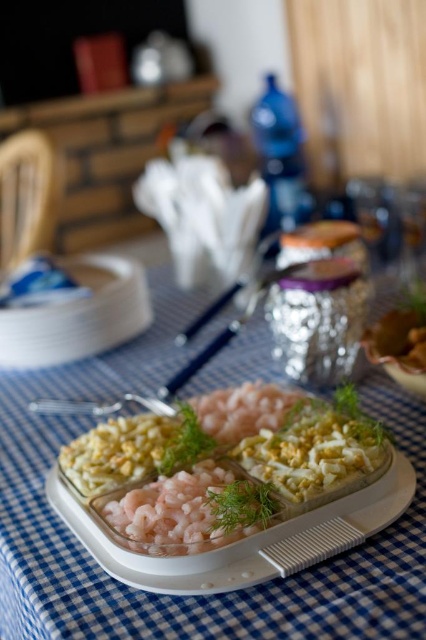
Looking at this image, you are a food critic evaluating the dish. You notice two main components at the center of the dish. Which one is taller, the pink translucent shrimp at center or the white creamy pasta at center?

The white creamy pasta at center is taller than the pink translucent shrimp at center.

Looking at this image, you are a server who needs to place a small bowl of sauce between the blue checkered tablecloth at center and the pink translucent shrimp at center. Is there enough space for the bowl?

The distance between the blue checkered tablecloth at center and the pink translucent shrimp at center is 7.37 inches. Since the bowl requires at least 6 inches of space, it should fit comfortably between them.